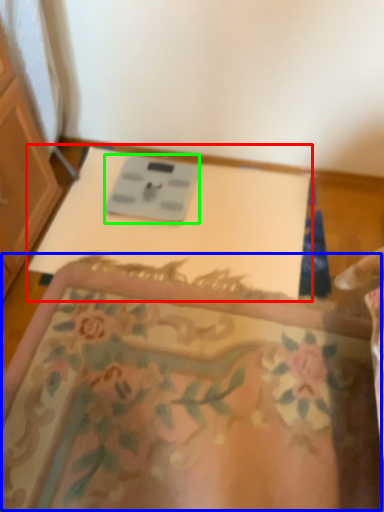
Question: Which object is positioned closest to changing table (highlighted by a red box)? Select from mat (highlighted by a blue box) and scale (highlighted by a green box).

Choices:
 (A) mat
 (B) scale

Answer: (B)